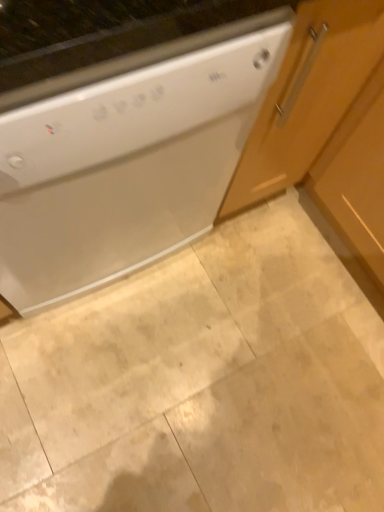
Question: Is wooden cabinet at right located within white glossy dishwasher at upper left?

Choices:
 (A) yes
 (B) no

Answer: (B)

Question: Considering the relative sizes of white glossy dishwasher at upper left and wooden cabinet at right in the image provided, is white glossy dishwasher at upper left wider than wooden cabinet at right?

Choices:
 (A) no
 (B) yes

Answer: (A)

Question: Is white glossy dishwasher at upper left closer to the viewer compared to wooden cabinet at right?

Choices:
 (A) yes
 (B) no

Answer: (A)

Question: Is white glossy dishwasher at upper left further to camera compared to wooden cabinet at right?

Choices:
 (A) yes
 (B) no

Answer: (B)

Question: Is white glossy dishwasher at upper left outside of wooden cabinet at right?

Choices:
 (A) no
 (B) yes

Answer: (B)

Question: In the image, is wooden cabinet at right on the left side or the right side of beige marble floor at center?

Choices:
 (A) right
 (B) left

Answer: (A)

Question: Is wooden cabinet at right spatially inside beige marble floor at center, or outside of it?

Choices:
 (A) inside
 (B) outside

Answer: (B)

Question: Is wooden cabinet at right wider or thinner than beige marble floor at center?

Choices:
 (A) thin
 (B) wide

Answer: (A)

Question: Relative to beige marble floor at center, is wooden cabinet at right in front or behind?

Choices:
 (A) behind
 (B) front

Answer: (B)

Question: Is white glossy dishwasher at upper left wider or thinner than beige marble floor at center?

Choices:
 (A) thin
 (B) wide

Answer: (A)

Question: From a real-world perspective, relative to beige marble floor at center, is white glossy dishwasher at upper left vertically above or below?

Choices:
 (A) above
 (B) below

Answer: (A)

Question: In terms of height, does white glossy dishwasher at upper left look taller or shorter compared to beige marble floor at center?

Choices:
 (A) short
 (B) tall

Answer: (B)

Question: Considering the relative positions of white glossy dishwasher at upper left and beige marble floor at center in the image provided, is white glossy dishwasher at upper left to the left or to the right of beige marble floor at center?

Choices:
 (A) left
 (B) right

Answer: (A)

Question: Considering the positions of beige marble floor at center and white glossy dishwasher at upper left in the image, is beige marble floor at center wider or thinner than white glossy dishwasher at upper left?

Choices:
 (A) thin
 (B) wide

Answer: (B)

Question: Is beige marble floor at center bigger or smaller than white glossy dishwasher at upper left?

Choices:
 (A) small
 (B) big

Answer: (A)